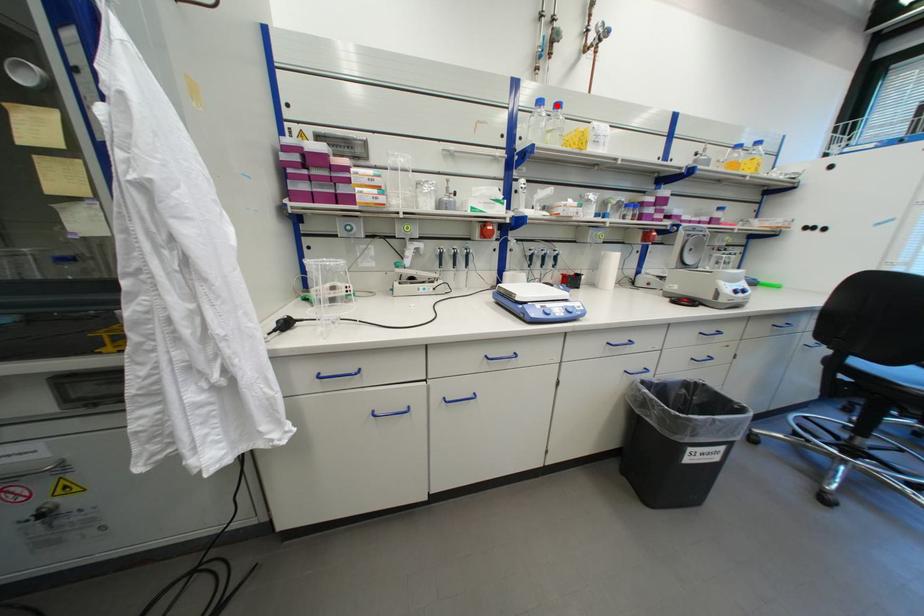
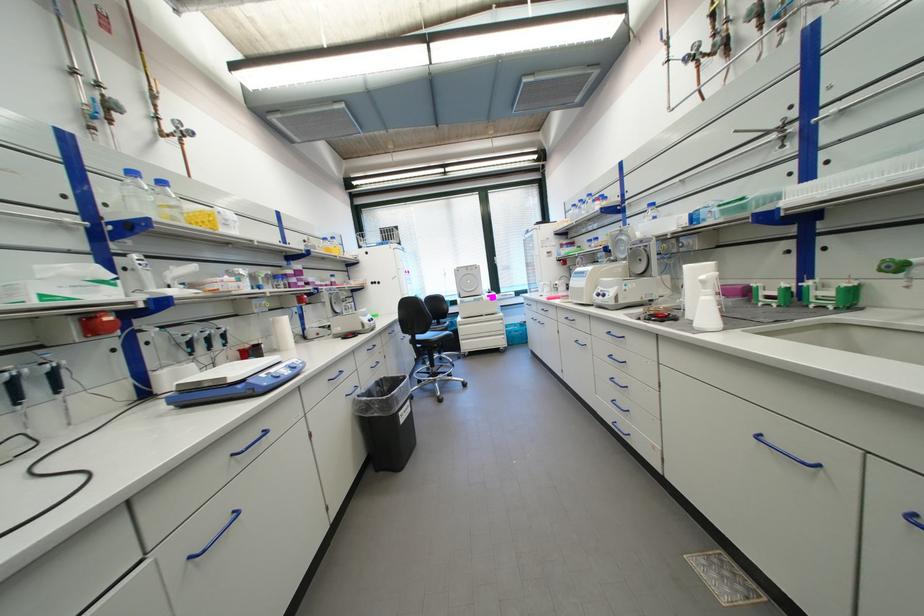
Where in the second image is the point corresponding to the highlighted location from the first image?

(156, 180)